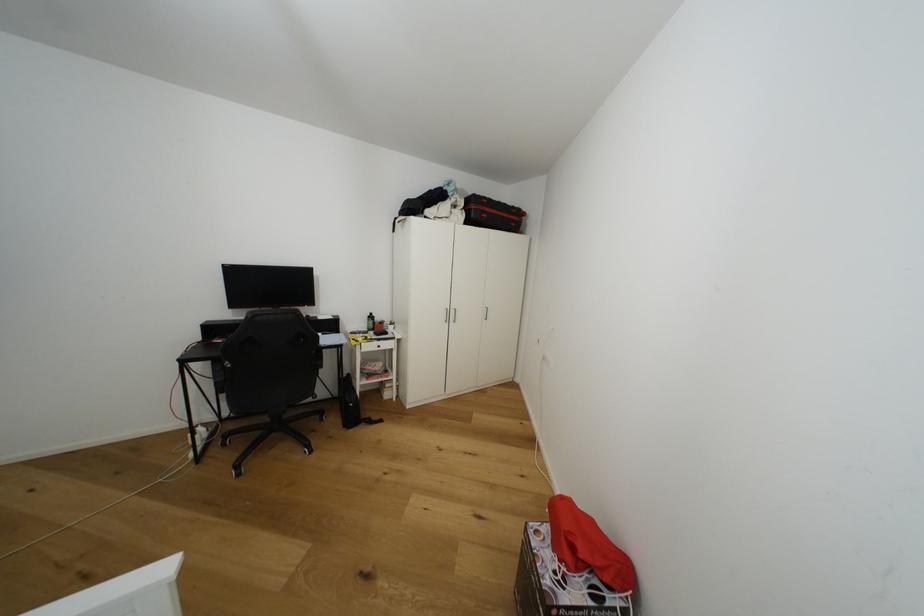
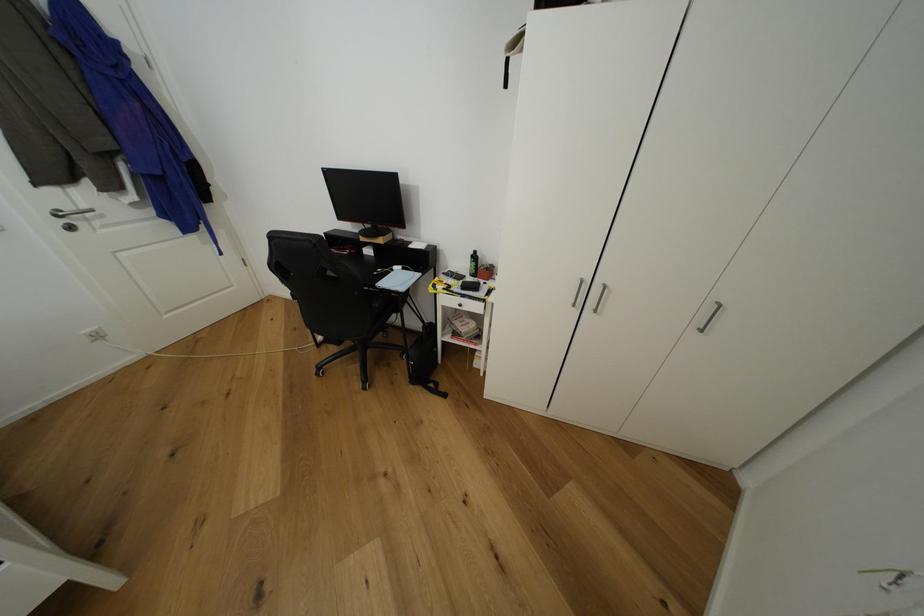
Where in the second image is the point corresponding to pixel 373 318 from the first image?

(478, 257)